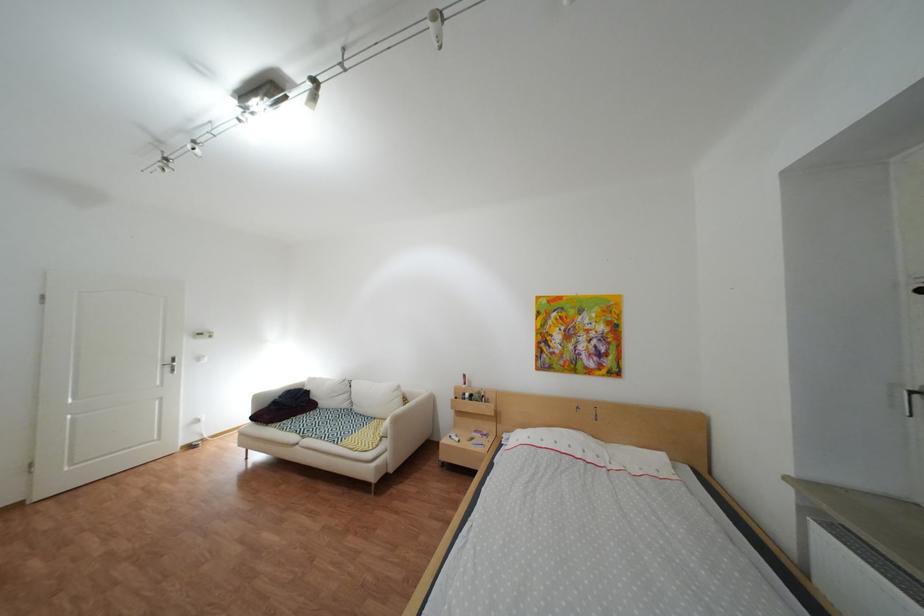
Identify the location of small black container. (480, 395).